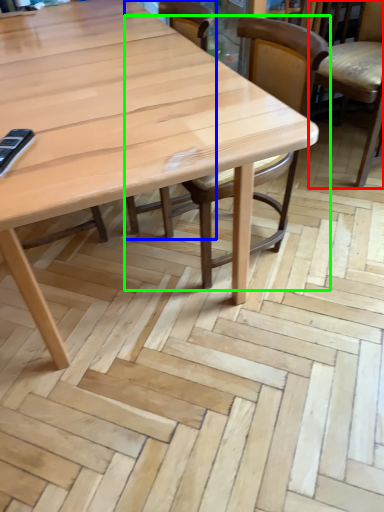
Question: Which object is positioned closest to chair (highlighted by a red box)? Select from chair (highlighted by a blue box) and chair (highlighted by a green box).

Choices:
 (A) chair
 (B) chair

Answer: (B)